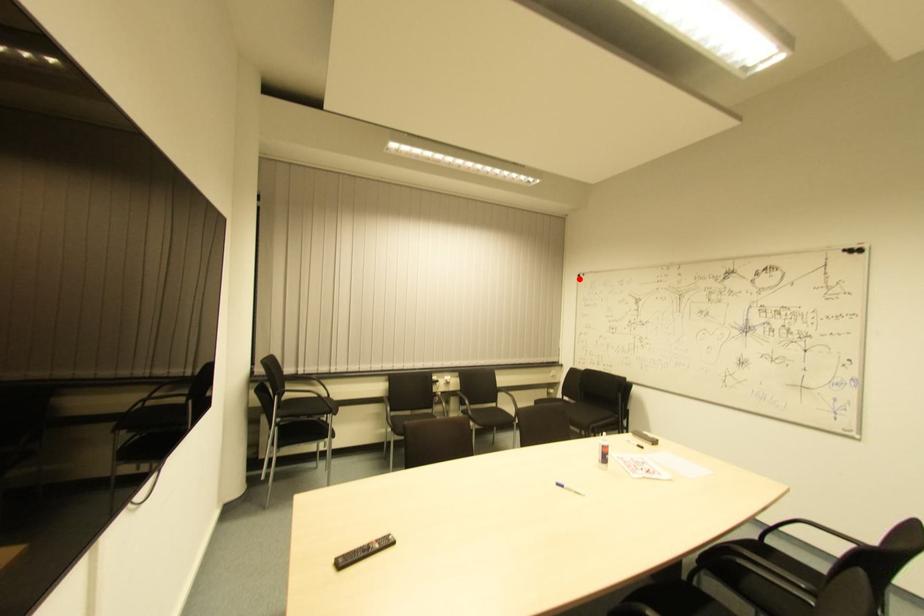
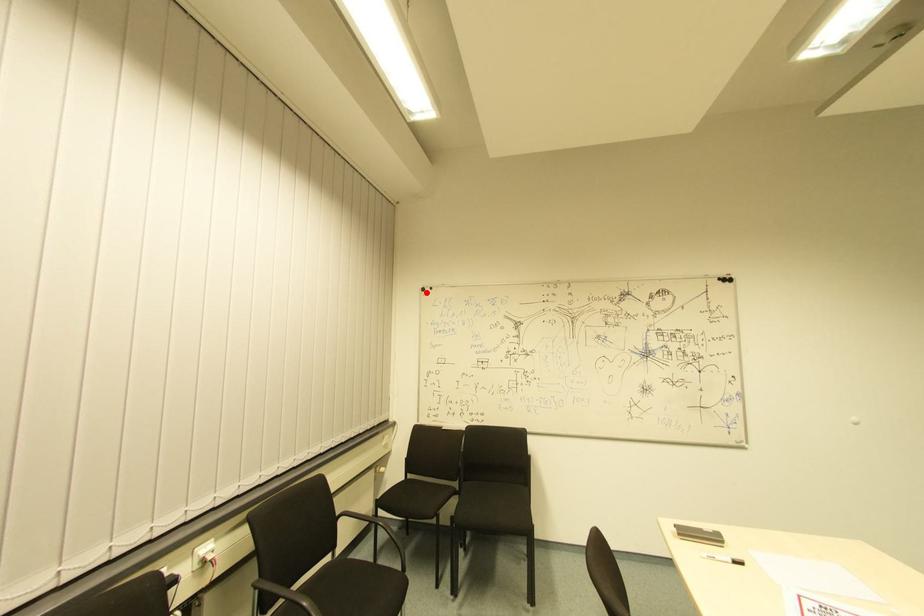
I am providing you with two images of the same scene from different viewpoints. A red point is marked on the first image and another point is marked on the second image. Do the highlighted points in image1 and image2 indicate the same real-world spot?

Yes